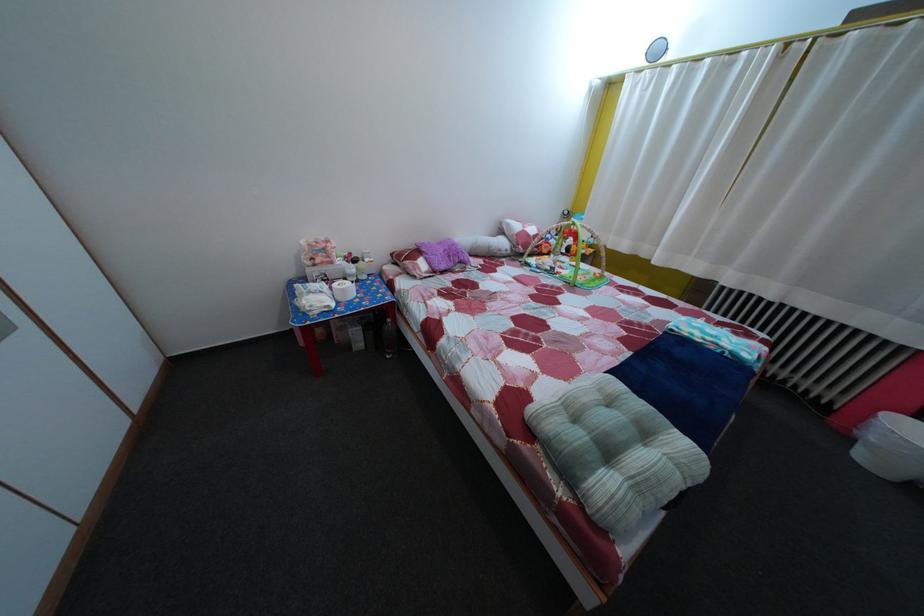
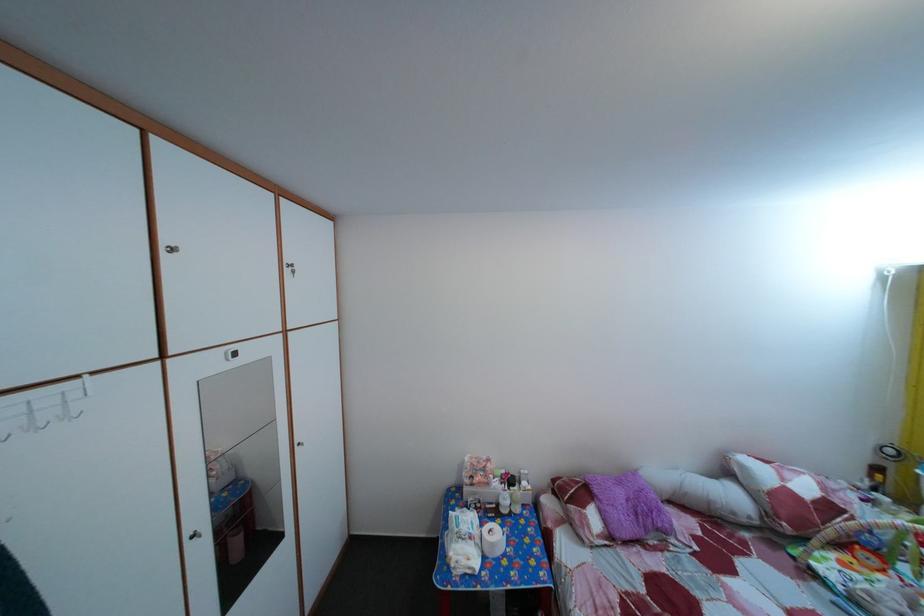
The point at (367, 265) is marked in the first image. Where is the corresponding point in the second image?

(524, 485)